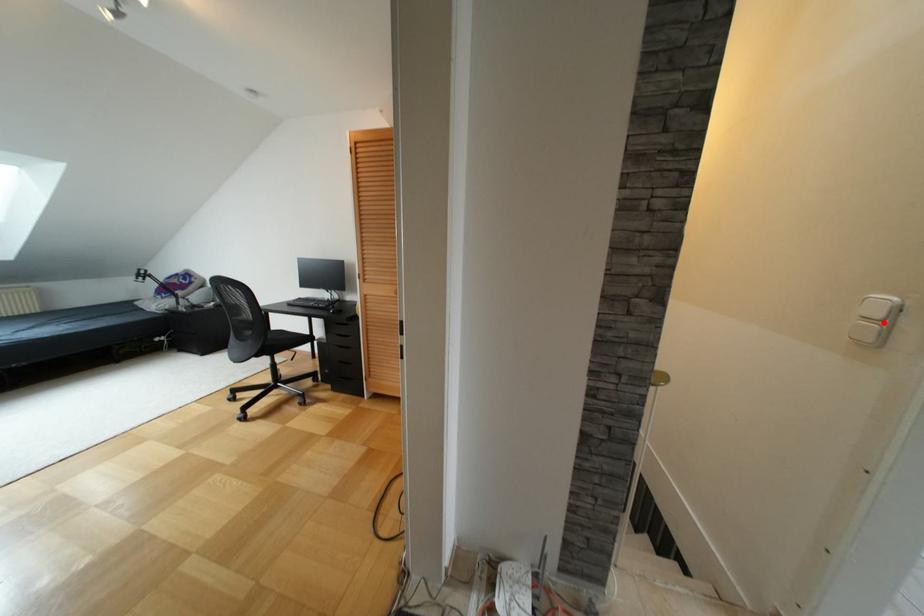
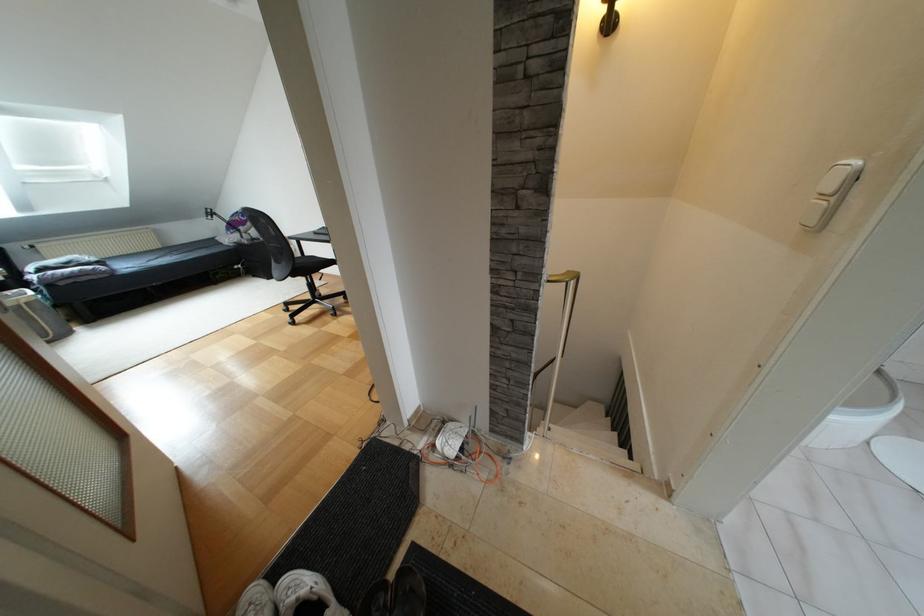
Locate, in the second image, the point that corresponds to the highlighted location in the first image.

(833, 198)